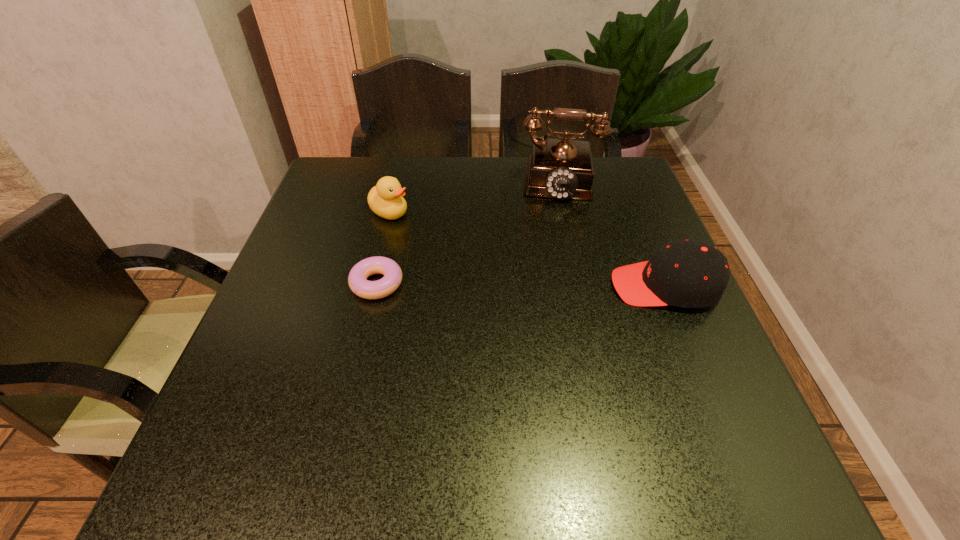
I want to click on the shortest object, so click(x=357, y=279).

Find the location of a particular element. This screenshot has height=540, width=960. cap is located at coordinates (689, 274).

At what (x,y) coordinates should I click in order to perform the action: click on duckling. Please return your answer as a coordinate pair (x, y). This screenshot has height=540, width=960. Looking at the image, I should click on (385, 199).

Where is `telephone`? The width and height of the screenshot is (960, 540). telephone is located at coordinates (562, 168).

Locate an element on the screen. Image resolution: width=960 pixels, height=540 pixels. vacant space located 0.060m on the front of the shortest object is located at coordinates (368, 325).

The image size is (960, 540). What are the coordinates of `free space located on the front-facing side of the cap` in the screenshot? It's located at (499, 286).

Locate an element on the screen. free space located 0.240m on the front-facing side of the cap is located at coordinates (503, 286).

Locate an element on the screen. free space located on the front-facing side of the cap is located at coordinates (468, 286).

The width and height of the screenshot is (960, 540). I want to click on vacant space located on the face of the duckling, so (533, 288).

The image size is (960, 540). In order to click on vacant region located on the face of the duckling in this screenshot , I will do `click(439, 237)`.